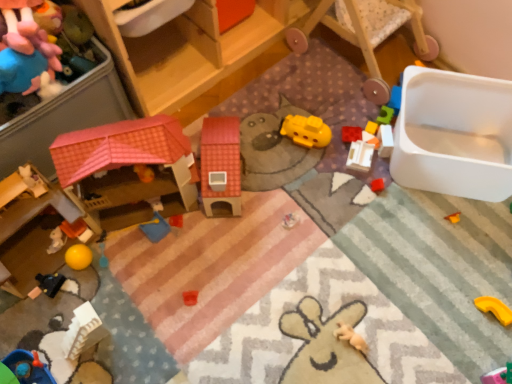
Identify the location of vacant space that is in between white plastic blocks at right, which is the second toy in right-to-left order, and yellow matte submarine at center, the 7th toy when ordered from right to left. This screenshot has height=384, width=512. (349, 140).